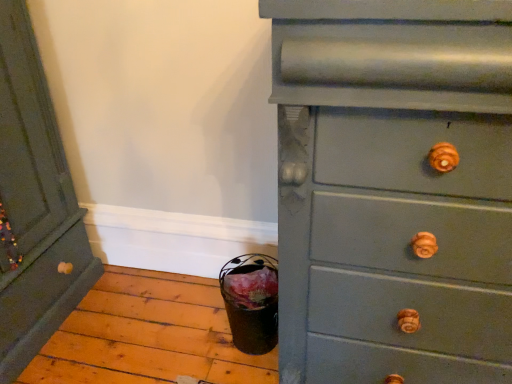
Describe the element at coordinates (34, 205) in the screenshot. The image size is (512, 384). I see `matte green dresser at left, the second chest of drawers in the right-to-left sequence` at that location.

Where is `matte green dresser at left, acting as the first chest of drawers starting from the left`? matte green dresser at left, acting as the first chest of drawers starting from the left is located at coordinates (34, 205).

Measure the distance between point [49,94] and camera.

A distance of 5.14 feet exists between point [49,94] and camera.

You are a GUI agent. You are given a task and a screenshot of the screen. Output one action in this format:
    pyautogui.click(x=<x>, y=<y>)
    Task: Click on the matte gray dresser at right, the 2th chest of drawers when ordered from left to right
    The image size is (512, 384).
    Given the screenshot: What is the action you would take?
    pyautogui.click(x=394, y=189)

What is the approximate width of matte gray dresser at right, the 1th chest of drawers positioned from the right?

21.71 inches.

Describe the element at coordinates (394, 189) in the screenshot. I see `matte gray dresser at right, the 2th chest of drawers when ordered from left to right` at that location.

What is the approximate height of matte gray dresser at right, the 1th chest of drawers positioned from the right?

3.84 feet.

Locate an element on the screen. matte green dresser at left, the second chest of drawers in the right-to-left sequence is located at coordinates (34, 205).

Would you say matte green dresser at left, acting as the first chest of drawers starting from the left, is to the left or to the right of matte gray dresser at right, the 2th chest of drawers when ordered from left to right, in the picture?

matte green dresser at left, acting as the first chest of drawers starting from the left, is positioned on matte gray dresser at right, the 2th chest of drawers when ordered from left to right,'s left side.

Between matte green dresser at left, acting as the first chest of drawers starting from the left, and matte gray dresser at right, the 2th chest of drawers when ordered from left to right, which one is positioned in front?

Positioned in front is matte gray dresser at right, the 2th chest of drawers when ordered from left to right.

Does point (0, 61) come closer to viewer compared to point (303, 55)?

No, (0, 61) is further to viewer.

From the image's perspective, is matte green dresser at left, the second chest of drawers in the right-to-left sequence, above matte gray dresser at right, the 2th chest of drawers when ordered from left to right?

Yes, from the image's perspective, matte green dresser at left, the second chest of drawers in the right-to-left sequence, is above matte gray dresser at right, the 2th chest of drawers when ordered from left to right.

From a real-world perspective, does matte green dresser at left, the second chest of drawers in the right-to-left sequence, stand above matte gray dresser at right, the 1th chest of drawers positioned from the right?

No, from a real-world perspective, matte green dresser at left, the second chest of drawers in the right-to-left sequence, is not over matte gray dresser at right, the 1th chest of drawers positioned from the right

In the scene shown: Considering the sizes of objects matte green dresser at left, the second chest of drawers in the right-to-left sequence, and matte gray dresser at right, the 1th chest of drawers positioned from the right, in the image provided, who is thinner, matte green dresser at left, the second chest of drawers in the right-to-left sequence, or matte gray dresser at right, the 1th chest of drawers positioned from the right,?

Thinner between the two is matte gray dresser at right, the 1th chest of drawers positioned from the right.

Which of these two, matte green dresser at left, the second chest of drawers in the right-to-left sequence, or matte gray dresser at right, the 1th chest of drawers positioned from the right, stands shorter?

Standing shorter between the two is matte green dresser at left, the second chest of drawers in the right-to-left sequence.

Looking at this image, in terms of size, does matte green dresser at left, the second chest of drawers in the right-to-left sequence, appear bigger or smaller than matte gray dresser at right, the 1th chest of drawers positioned from the right?

matte green dresser at left, the second chest of drawers in the right-to-left sequence, is smaller than matte gray dresser at right, the 1th chest of drawers positioned from the right.

Is matte green dresser at left, acting as the first chest of drawers starting from the left, inside or outside of matte gray dresser at right, the 2th chest of drawers when ordered from left to right?

matte green dresser at left, acting as the first chest of drawers starting from the left, lies outside matte gray dresser at right, the 2th chest of drawers when ordered from left to right.

Can you see matte green dresser at left, the second chest of drawers in the right-to-left sequence, touching matte gray dresser at right, the 1th chest of drawers positioned from the right?

matte green dresser at left, the second chest of drawers in the right-to-left sequence, is not next to matte gray dresser at right, the 1th chest of drawers positioned from the right, and they're not touching.

Is matte green dresser at left, the second chest of drawers in the right-to-left sequence, positioned with its back to matte gray dresser at right, the 2th chest of drawers when ordered from left to right?

No, matte green dresser at left, the second chest of drawers in the right-to-left sequence, is not facing the opposite direction of matte gray dresser at right, the 2th chest of drawers when ordered from left to right.

What's the angular difference between matte green dresser at left, acting as the first chest of drawers starting from the left, and matte gray dresser at right, the 2th chest of drawers when ordered from left to right,'s facing directions?

There is a 89.9-degree angle between the facing directions of matte green dresser at left, acting as the first chest of drawers starting from the left, and matte gray dresser at right, the 2th chest of drawers when ordered from left to right.

I want to click on chest of drawers lying on the right of matte green dresser at left, acting as the first chest of drawers starting from the left, so click(x=394, y=189).

Considering the positions of objects matte gray dresser at right, the 2th chest of drawers when ordered from left to right, and matte green dresser at left, acting as the first chest of drawers starting from the left, in the image provided, who is more to the left, matte gray dresser at right, the 2th chest of drawers when ordered from left to right, or matte green dresser at left, acting as the first chest of drawers starting from the left,?

matte green dresser at left, acting as the first chest of drawers starting from the left.

Is matte gray dresser at right, the 2th chest of drawers when ordered from left to right, positioned in front of matte green dresser at left, acting as the first chest of drawers starting from the left?

Yes.

Is point (510, 144) positioned behind point (11, 34)?

No.

From the image's perspective, is matte gray dresser at right, the 2th chest of drawers when ordered from left to right, positioned above or below matte green dresser at left, the second chest of drawers in the right-to-left sequence?

matte gray dresser at right, the 2th chest of drawers when ordered from left to right, is situated lower than matte green dresser at left, the second chest of drawers in the right-to-left sequence, in the image.

From a real-world perspective, who is located lower, matte gray dresser at right, the 1th chest of drawers positioned from the right, or matte green dresser at left, acting as the first chest of drawers starting from the left?

matte green dresser at left, acting as the first chest of drawers starting from the left.

In terms of width, does matte gray dresser at right, the 2th chest of drawers when ordered from left to right, look wider or thinner when compared to matte green dresser at left, acting as the first chest of drawers starting from the left?

Considering their sizes, matte gray dresser at right, the 2th chest of drawers when ordered from left to right, looks slimmer than matte green dresser at left, acting as the first chest of drawers starting from the left.

Does matte gray dresser at right, the 2th chest of drawers when ordered from left to right, have a lesser height compared to matte green dresser at left, acting as the first chest of drawers starting from the left?

Incorrect, the height of matte gray dresser at right, the 2th chest of drawers when ordered from left to right, does not fall short of that of matte green dresser at left, acting as the first chest of drawers starting from the left.

Who is smaller, matte gray dresser at right, the 2th chest of drawers when ordered from left to right, or matte green dresser at left, the second chest of drawers in the right-to-left sequence?

matte green dresser at left, the second chest of drawers in the right-to-left sequence.

Would you say matte gray dresser at right, the 2th chest of drawers when ordered from left to right, is outside matte green dresser at left, the second chest of drawers in the right-to-left sequence?

That's correct, matte gray dresser at right, the 2th chest of drawers when ordered from left to right, is outside of matte green dresser at left, the second chest of drawers in the right-to-left sequence.

Is matte gray dresser at right, the 1th chest of drawers positioned from the right, not near matte green dresser at left, the second chest of drawers in the right-to-left sequence?

Indeed, matte gray dresser at right, the 1th chest of drawers positioned from the right, is not near matte green dresser at left, the second chest of drawers in the right-to-left sequence.

Does matte gray dresser at right, the 2th chest of drawers when ordered from left to right, turn towards matte green dresser at left, acting as the first chest of drawers starting from the left?

No.

Could you measure the distance between matte gray dresser at right, the 2th chest of drawers when ordered from left to right, and matte green dresser at left, acting as the first chest of drawers starting from the left?

A distance of 3.56 feet exists between matte gray dresser at right, the 2th chest of drawers when ordered from left to right, and matte green dresser at left, acting as the first chest of drawers starting from the left.

The width and height of the screenshot is (512, 384). Identify the location of the chest of drawers in front of the matte green dresser at left, the second chest of drawers in the right-to-left sequence. (394, 189).

Find the location of a particular element. Image resolution: width=512 pixels, height=384 pixels. chest of drawers behind the matte gray dresser at right, the 1th chest of drawers positioned from the right is located at coordinates 34,205.

This screenshot has height=384, width=512. Identify the location of chest of drawers that appears on the left of matte gray dresser at right, the 2th chest of drawers when ordered from left to right. (34, 205).